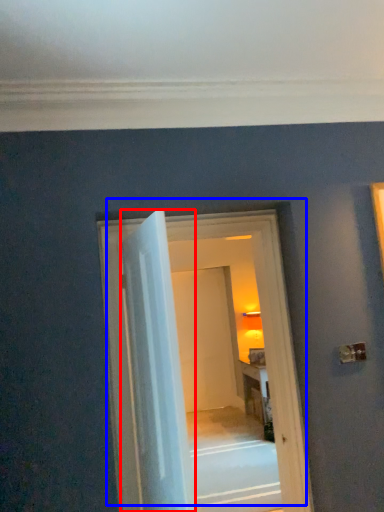
Question: Which object appears farthest to the camera in this image, door (highlighted by a red box) or door (highlighted by a blue box)?

Choices:
 (A) door
 (B) door

Answer: (B)